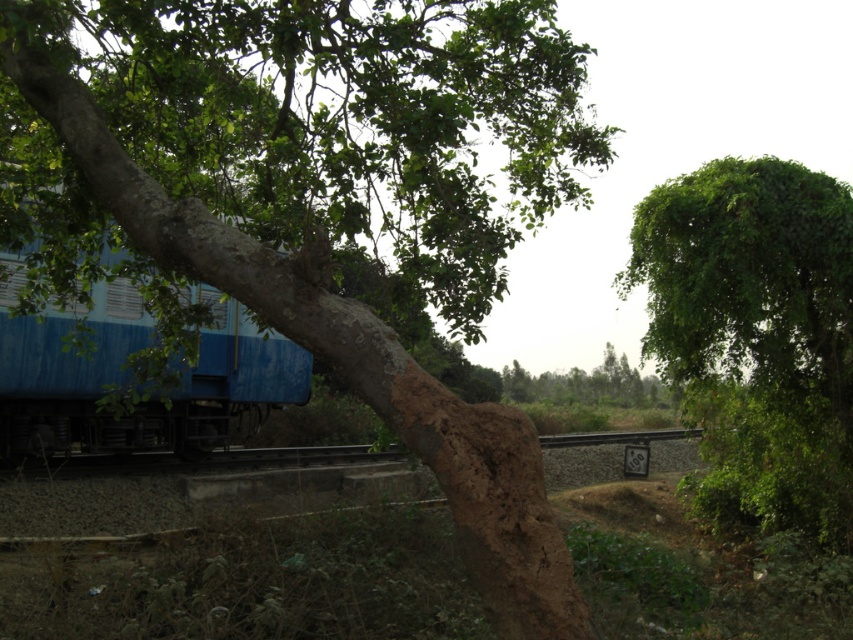
Does brown rough bark tree at center appear on the left side of green leafy tree at upper right?

Indeed, brown rough bark tree at center is positioned on the left side of green leafy tree at upper right.

Can you confirm if brown rough bark tree at center is positioned below green leafy tree at upper right?

No, brown rough bark tree at center is not below green leafy tree at upper right.

This screenshot has width=853, height=640. What do you see at coordinates (316, 202) in the screenshot?
I see `brown rough bark tree at center` at bounding box center [316, 202].

This screenshot has width=853, height=640. Identify the location of brown rough bark tree at center. pos(316,202).

Can you confirm if green leafy tree at upper right is bigger than blue matte train at left?

No.

Between green leafy tree at upper right and blue matte train at left, which one is positioned higher?

blue matte train at left

Who is more forward, (793, 214) or (79, 376)?

Point (793, 214)

The height and width of the screenshot is (640, 853). Find the location of `green leafy tree at upper right`. green leafy tree at upper right is located at coordinates (757, 336).

From the picture: Can you confirm if brown rough bark tree at center is smaller than blue matte train at left?

Incorrect, brown rough bark tree at center is not smaller in size than blue matte train at left.

I want to click on brown rough bark tree at center, so click(316, 202).

Locate an element on the screen. The image size is (853, 640). brown rough bark tree at center is located at coordinates (316, 202).